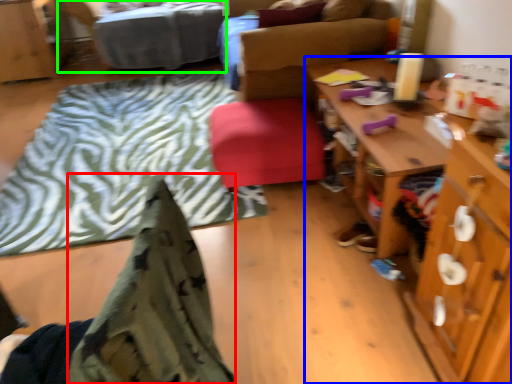
Question: Based on their relative distances, which object is nearer to blanket (highlighted by a red box)? Choose from desk (highlighted by a blue box) and bed (highlighted by a green box).

Choices:
 (A) desk
 (B) bed

Answer: (A)